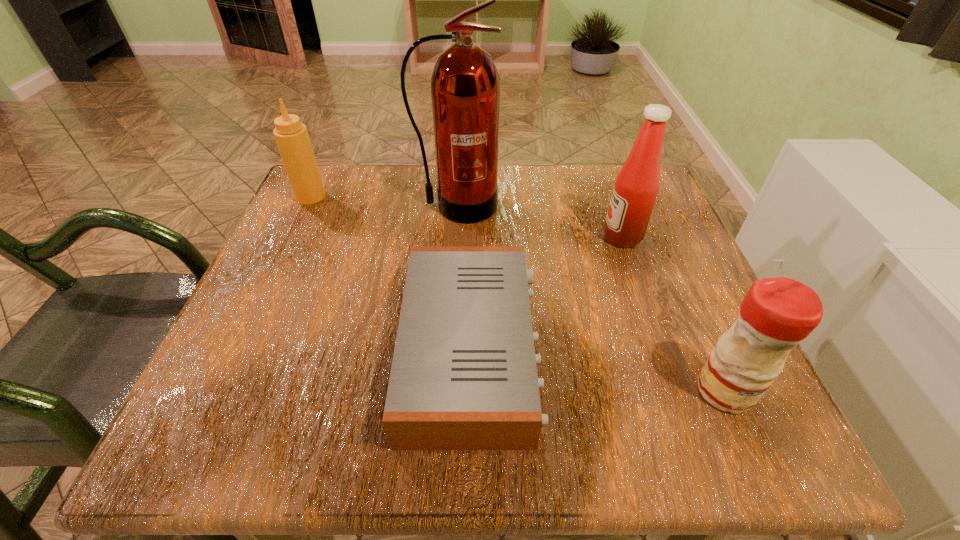
The image size is (960, 540). I want to click on free space located on the front-facing side of the second farthest condiment, so click(x=574, y=237).

Where is `blank area located 0.160m on the front of the leftmost object`? blank area located 0.160m on the front of the leftmost object is located at coordinates (285, 252).

Find the location of a particular element. vacant space positioned 0.350m on the left of the nearest condiment is located at coordinates (465, 390).

Locate an element on the screen. vacant region located 0.270m on the control panel of the radio receiver is located at coordinates (705, 350).

Where is `fire extinguisher at the far edge`? Image resolution: width=960 pixels, height=540 pixels. fire extinguisher at the far edge is located at coordinates (465, 87).

Where is `condiment at the far edge`? This screenshot has height=540, width=960. condiment at the far edge is located at coordinates (291, 136).

Identify the location of condiment located in the near edge section of the desktop. (776, 314).

Locate an element on the screen. This screenshot has width=960, height=540. radio receiver positioned at the near edge is located at coordinates point(464,377).

Locate an element on the screen. object located at the left edge is located at coordinates (291, 136).

This screenshot has width=960, height=540. I want to click on object at the far left corner, so click(291, 136).